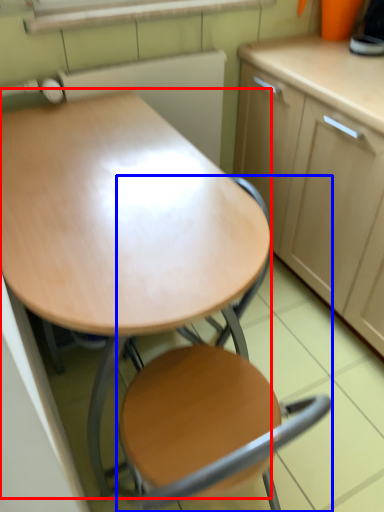
Question: Which point is further to the camera, desk (highlighted by a red box) or chair (highlighted by a blue box)?

Choices:
 (A) desk
 (B) chair

Answer: (A)